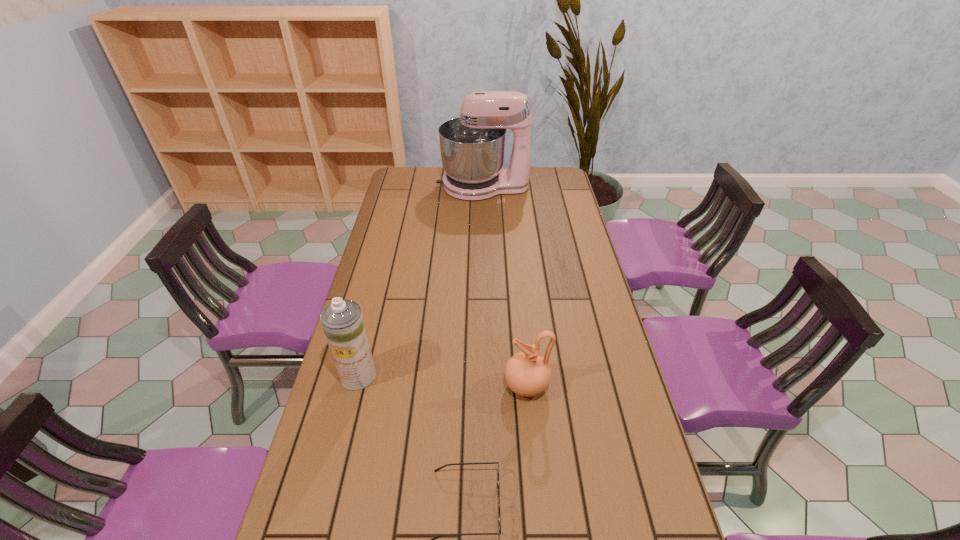
Identify the location of the tallest object. The image size is (960, 540). (472, 146).

Locate an element on the screen. the farthest object is located at coordinates (472, 146).

Where is `the leftmost object`? the leftmost object is located at coordinates (342, 321).

Where is `the third shortest object`? the third shortest object is located at coordinates (342, 321).

At what (x,y) coordinates should I click in order to perform the action: click on the second shortest object. Please return your answer as a coordinate pair (x, y). Looking at the image, I should click on (528, 374).

Locate an element on the screen. Image resolution: width=960 pixels, height=540 pixels. free space located 0.160m on the front-facing side of the tallest object is located at coordinates (x=403, y=186).

The height and width of the screenshot is (540, 960). I want to click on free region located 0.060m on the front-facing side of the tallest object, so click(x=424, y=186).

The height and width of the screenshot is (540, 960). What are the coordinates of `vacant space located on the front-facing side of the tallest object` in the screenshot? It's located at (407, 186).

Locate an element on the screen. The height and width of the screenshot is (540, 960). vacant space located 0.290m on the front of the aerosol can is located at coordinates (327, 497).

Where is `vacant region located on the spout of the pottery`? The height and width of the screenshot is (540, 960). vacant region located on the spout of the pottery is located at coordinates (465, 386).